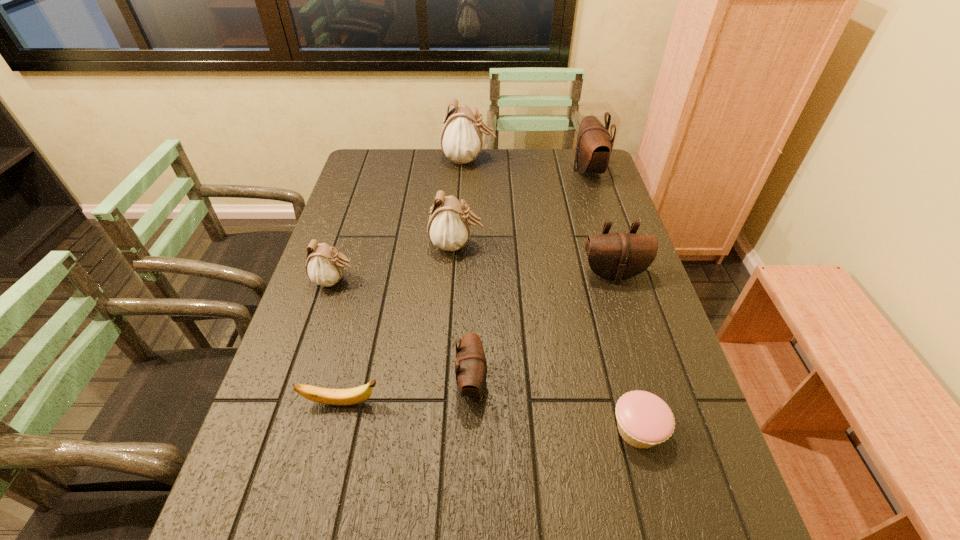
Locate an element on the screen. Image resolution: width=960 pixels, height=540 pixels. free point between the second biggest brown pouch and the nearest white pouch is located at coordinates (474, 278).

Identify the location of free space between the second smallest brown pouch and the leftmost pouch. Image resolution: width=960 pixels, height=540 pixels. (474, 278).

You are a GUI agent. You are given a task and a screenshot of the screen. Output one action in this format:
    pyautogui.click(x=<x>, y=<y>)
    Task: Click on the free spot between the farthest brown pouch and the second nearest white pouch
    
    Given the screenshot: What is the action you would take?
    pyautogui.click(x=522, y=208)

You are a GUI agent. You are given a task and a screenshot of the screen. Output one action in this format:
    pyautogui.click(x=<x>, y=<y>)
    Task: Click on the free space that is in between the second biggest white pouch and the nearest pouch
    
    Given the screenshot: What is the action you would take?
    pyautogui.click(x=465, y=314)

This screenshot has height=540, width=960. I want to click on vacant area between the second nearest white pouch and the farthest brown pouch, so click(x=522, y=208).

The width and height of the screenshot is (960, 540). In order to click on free space between the second nearest white pouch and the biggest brown pouch in this screenshot , I will do `click(522, 208)`.

The height and width of the screenshot is (540, 960). What are the coordinates of `free space that is in between the cupcake and the fourth nearest pouch` in the screenshot? It's located at (547, 338).

At what (x,y) coordinates should I click in order to perform the action: click on vacant space that's between the second smallest white pouch and the second farthest brown pouch. Please return your answer as a coordinate pair (x, y). Looking at the image, I should click on (535, 260).

Image resolution: width=960 pixels, height=540 pixels. I want to click on unoccupied position between the fourth nearest pouch and the yellow banana, so click(x=399, y=324).

You are a GUI agent. You are given a task and a screenshot of the screen. Output one action in this format:
    pyautogui.click(x=<x>, y=<y>)
    Task: Click on the free area in between the yellow banana and the cupcake
    
    Given the screenshot: What is the action you would take?
    pyautogui.click(x=490, y=416)